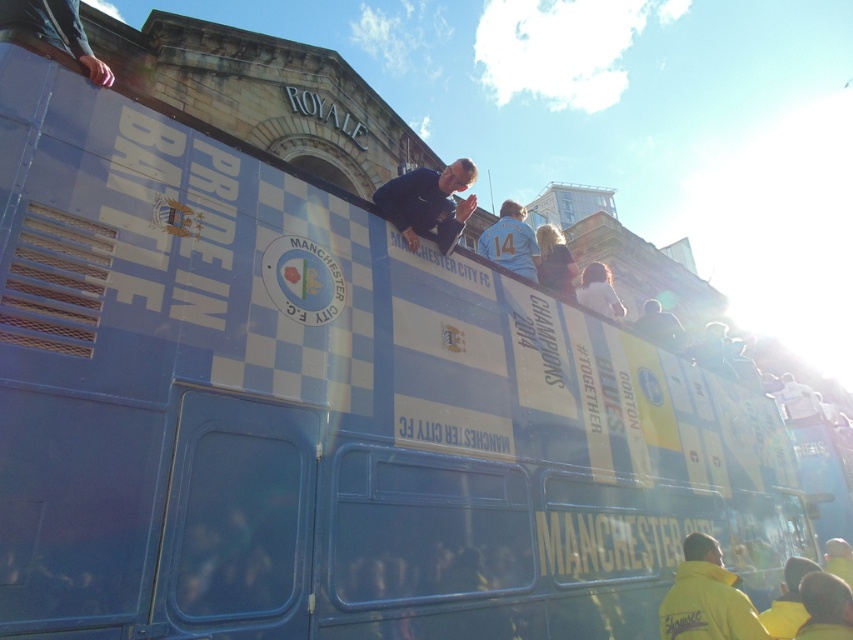
You are a photographer at the Manchester City FC event. You want to take a photo that includes both the blue fabric jacket at center and the yellow fabric person at lower right. Which object should you focus on first to ensure both are in frame?

The blue fabric jacket at center is larger in size than the yellow fabric person at lower right, so you should focus on the blue fabric jacket at center first to ensure both are in frame.

You are a photographer standing in front of the Manchester City FC bus. You notice the blue fabric jacket at center and the yellow fabric person at lower right. Which object is positioned more to the left side of the bus?

The blue fabric jacket at center is positioned more to the left side of the bus than the yellow fabric person at lower right.